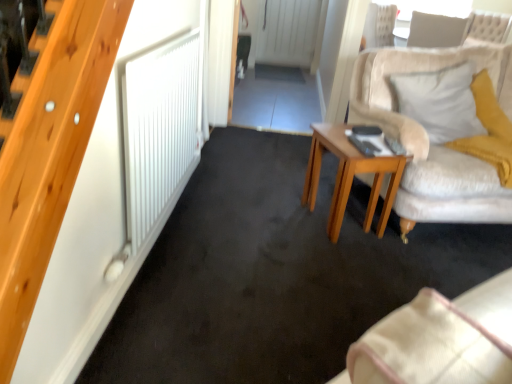
Question: From the image's perspective, is white fabric pillow at upper right, marked as the 1th pillow in a top-to-bottom arrangement, under white fabric pillow at upper right, the 2th pillow viewed from the top?

Choices:
 (A) no
 (B) yes

Answer: (A)

Question: Is white fabric pillow at upper right, the first pillow when ordered from right to left, oriented towards white fabric pillow at upper right, which is the 1th pillow in bottom-to-top order?

Choices:
 (A) no
 (B) yes

Answer: (A)

Question: Is white fabric pillow at upper right, the first pillow when ordered from right to left, thinner than white fabric pillow at upper right, acting as the first pillow starting from the front?

Choices:
 (A) yes
 (B) no

Answer: (B)

Question: Is white fabric pillow at upper right, which is the second pillow in front-to-back order, to the right of white fabric pillow at upper right, which is the 1th pillow in bottom-to-top order, from the viewer's perspective?

Choices:
 (A) no
 (B) yes

Answer: (B)

Question: Is the depth of white fabric pillow at upper right, acting as the 2th pillow starting from the bottom, greater than that of white fabric pillow at upper right, the first pillow from the left?

Choices:
 (A) yes
 (B) no

Answer: (A)

Question: Considering the positions of wooden side table at center and white fabric pillow at upper right, the first pillow when ordered from right to left, in the image, is wooden side table at center bigger or smaller than white fabric pillow at upper right, the first pillow when ordered from right to left,?

Choices:
 (A) small
 (B) big

Answer: (A)

Question: In terms of height, does wooden side table at center look taller or shorter compared to white fabric pillow at upper right, the first pillow when ordered from right to left?

Choices:
 (A) short
 (B) tall

Answer: (B)

Question: Is wooden side table at center wider or thinner than white fabric pillow at upper right, acting as the 2th pillow starting from the bottom?

Choices:
 (A) wide
 (B) thin

Answer: (B)

Question: Considering their positions, is wooden side table at center located in front of or behind white fabric pillow at upper right, the first pillow when ordered from right to left?

Choices:
 (A) behind
 (B) front

Answer: (B)

Question: From a real-world perspective, is white fabric pillow at upper right, which is the second pillow in front-to-back order, above or below white fabric pillow at upper right, the first pillow from the left?

Choices:
 (A) below
 (B) above

Answer: (B)

Question: In terms of height, does white fabric pillow at upper right, marked as the 1th pillow in a top-to-bottom arrangement, look taller or shorter compared to white fabric pillow at upper right, placed as the 2th pillow when sorted from right to left?

Choices:
 (A) short
 (B) tall

Answer: (A)

Question: From the image's perspective, is white fabric pillow at upper right, which is the 1th pillow from back to front, above or below white fabric pillow at upper right, placed as the 2th pillow when sorted from right to left?

Choices:
 (A) below
 (B) above

Answer: (B)

Question: Looking at their shapes, would you say white fabric pillow at upper right, the first pillow when ordered from right to left, is wider or thinner than white fabric pillow at upper right, which is the 1th pillow in bottom-to-top order?

Choices:
 (A) thin
 (B) wide

Answer: (B)

Question: Is white fabric pillow at upper right, which is the second pillow in front-to-back order, bigger or smaller than wooden side table at center?

Choices:
 (A) small
 (B) big

Answer: (B)

Question: Do you think white fabric pillow at upper right, acting as the 2th pillow starting from the bottom, is within wooden side table at center, or outside of it?

Choices:
 (A) outside
 (B) inside

Answer: (A)